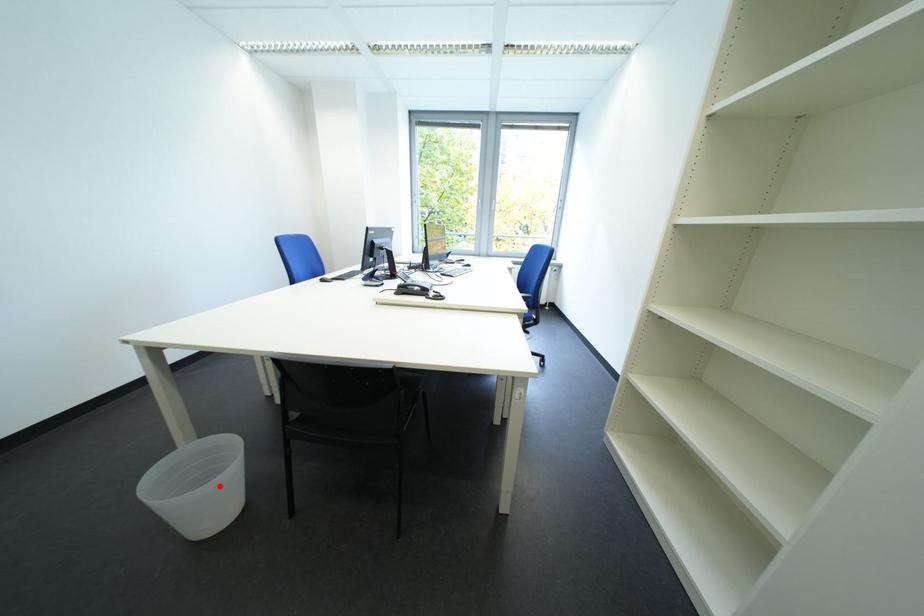
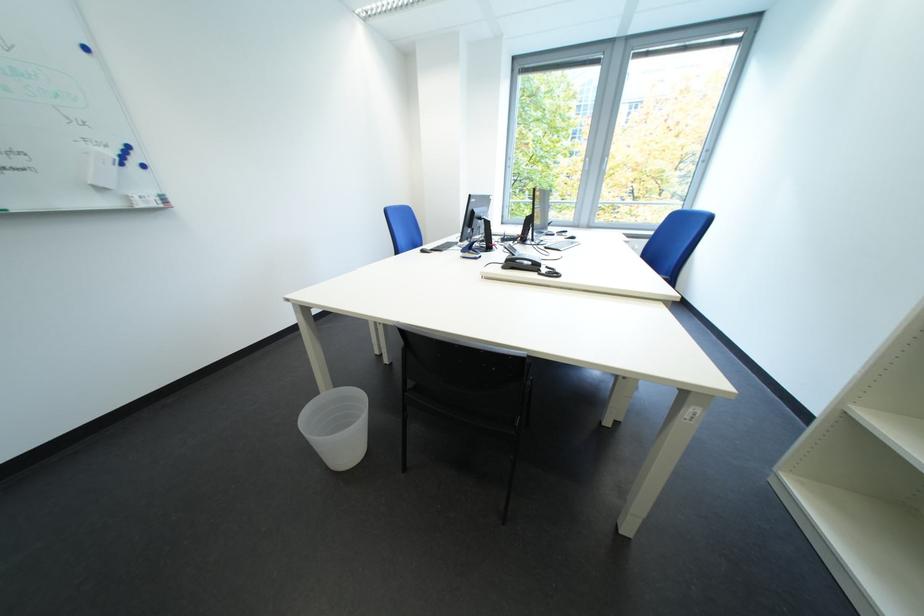
Find the pixel in the second image that matches the highlighted location in the first image.

(354, 429)